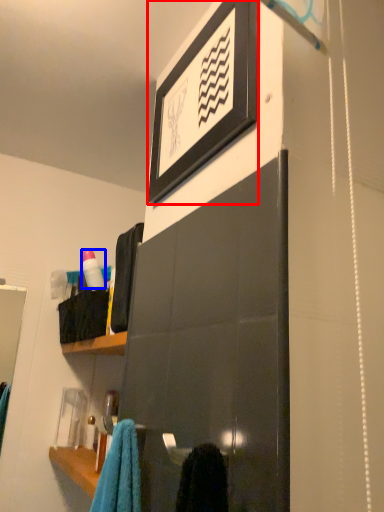
Question: Which object appears farthest to the camera in this image, picture frame (highlighted by a red box) or bottle (highlighted by a blue box)?

Choices:
 (A) picture frame
 (B) bottle

Answer: (B)